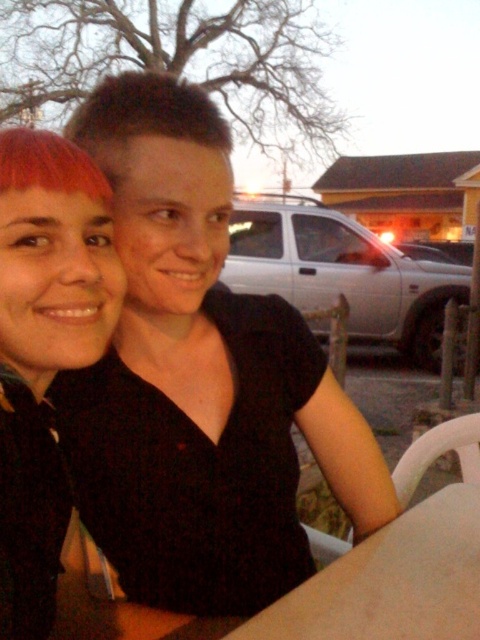
You are a photographer trying to adjust the lighting for a portrait. You notice the black matte shirt at center and the matte black hair at left. Which object is covering part of the other?

The black matte shirt at center is positioned over matte black hair at left, so the shirt is covering part of the hair.

Based on the scene description, where is the matte black hair at left located in terms of coordinates?

The matte black hair at left is located at coordinates point (45,349).